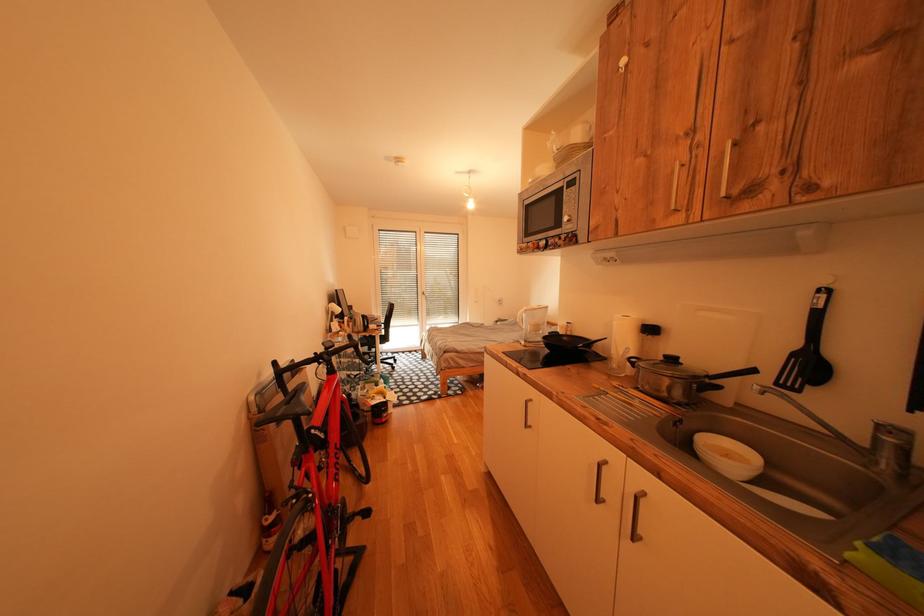
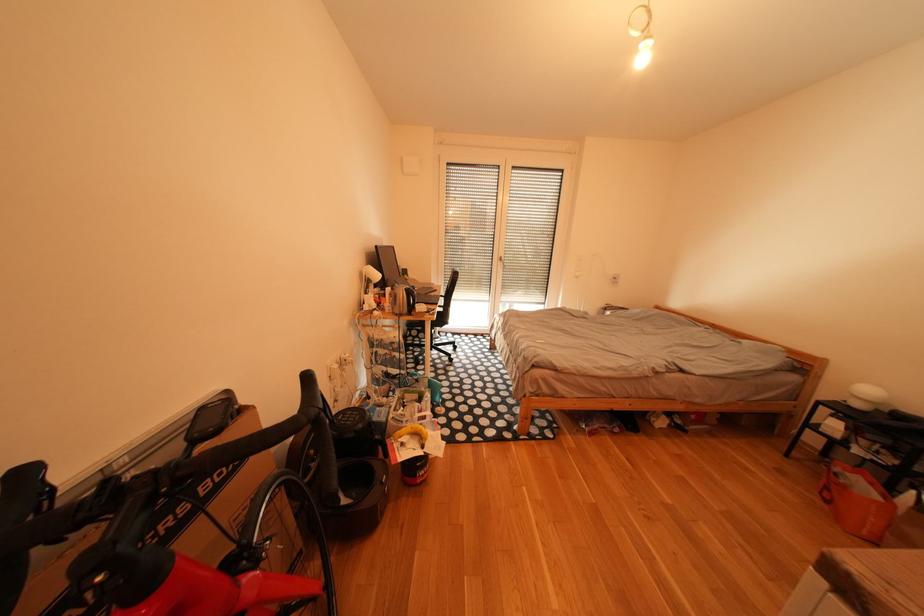
Question: What movement of the cameraman would produce the second image?

Choices:
 (A) Left
 (B) Right
 (C) Forward
 (D) Backward

Answer: (C)